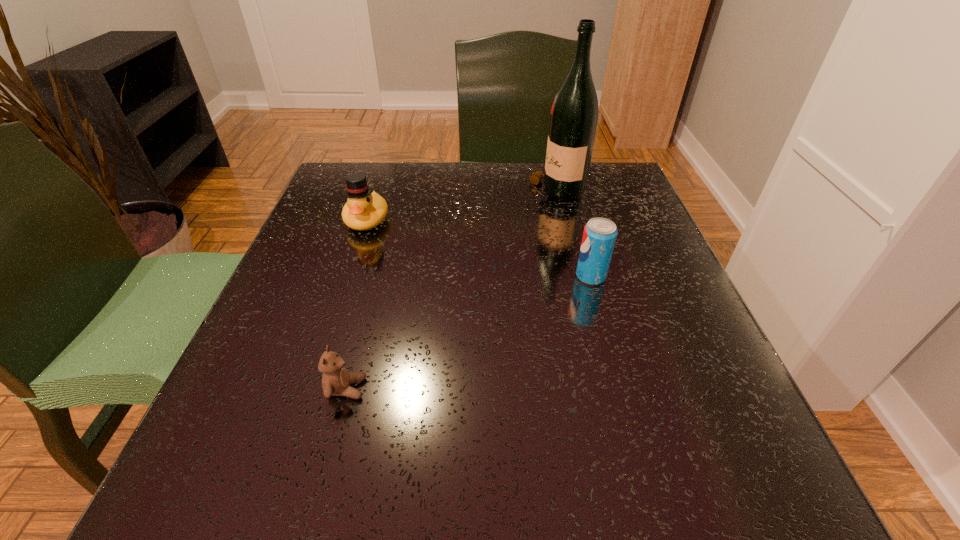
The width and height of the screenshot is (960, 540). What are the coordinates of `free location at the near edge of the desktop` in the screenshot? It's located at (313, 487).

Where is `free region at the right edge of the desktop`? Image resolution: width=960 pixels, height=540 pixels. free region at the right edge of the desktop is located at coordinates (621, 219).

Locate an element on the screen. The height and width of the screenshot is (540, 960). vacant space at the far left corner is located at coordinates (342, 210).

Image resolution: width=960 pixels, height=540 pixels. Identify the location of free region at the far right corner of the desktop. (597, 162).

This screenshot has height=540, width=960. Find the location of `free space between the teddy bear and the duck`. free space between the teddy bear and the duck is located at coordinates (357, 304).

Image resolution: width=960 pixels, height=540 pixels. I want to click on free area in between the shortest object and the duck, so click(357, 304).

This screenshot has width=960, height=540. I want to click on empty space between the shortest object and the tallest object, so click(450, 291).

Identify the location of vacant space that's between the tallest object and the second nearest object. The width and height of the screenshot is (960, 540). (573, 234).

The height and width of the screenshot is (540, 960). I want to click on empty location between the shortest object and the duck, so click(357, 304).

You are a GUI agent. You are given a task and a screenshot of the screen. Output one action in this format:
    pyautogui.click(x=<x>, y=<y>)
    Task: Click on the free point between the nearest object and the duck
    The image size is (960, 540).
    Given the screenshot: What is the action you would take?
    pyautogui.click(x=357, y=304)